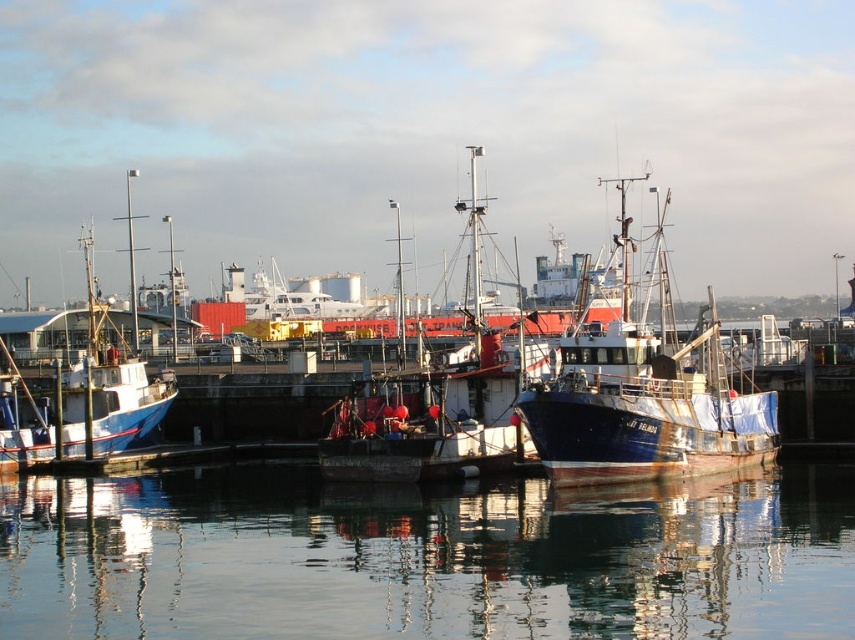
Which is below, transparent water at center or wooden boat at center?

transparent water at center is lower down.

Identify the location of transparent water at center. (425, 557).

Does wooden boat at center appear on the left side of blue painted wooden boat at left?

No, wooden boat at center is not to the left of blue painted wooden boat at left.

Is point (497, 456) more distant than point (107, 371)?

No, it is in front of (107, 371).

The width and height of the screenshot is (855, 640). I want to click on wooden boat at center, so click(433, 404).

Who is more forward, [667,490] or [89,228]?

Point [667,490] is more forward.

Who is taller, transparent water at center or blue painted wooden boat at left?

blue painted wooden boat at left is taller.

This screenshot has width=855, height=640. I want to click on transparent water at center, so click(425, 557).

Where is `transparent water at center`? Image resolution: width=855 pixels, height=640 pixels. transparent water at center is located at coordinates (425, 557).